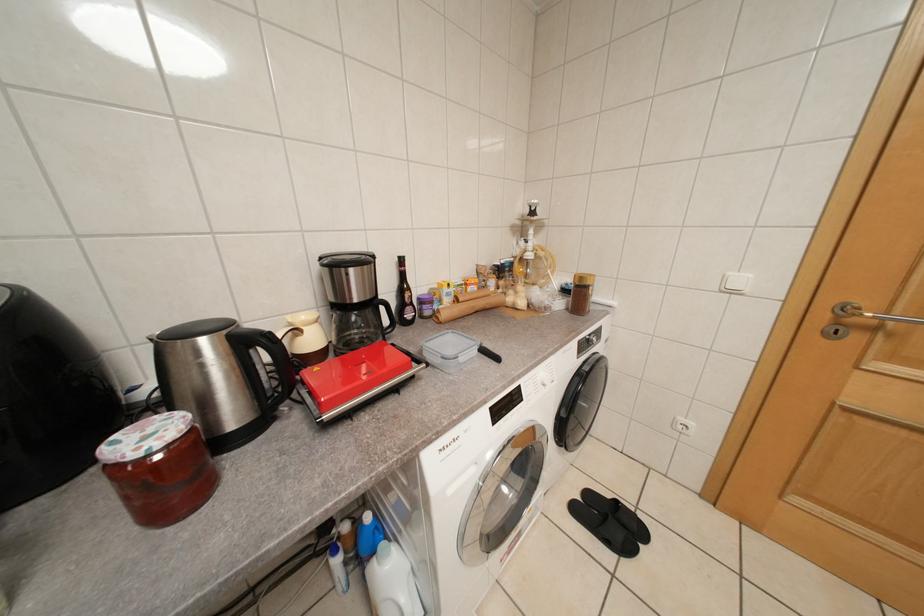
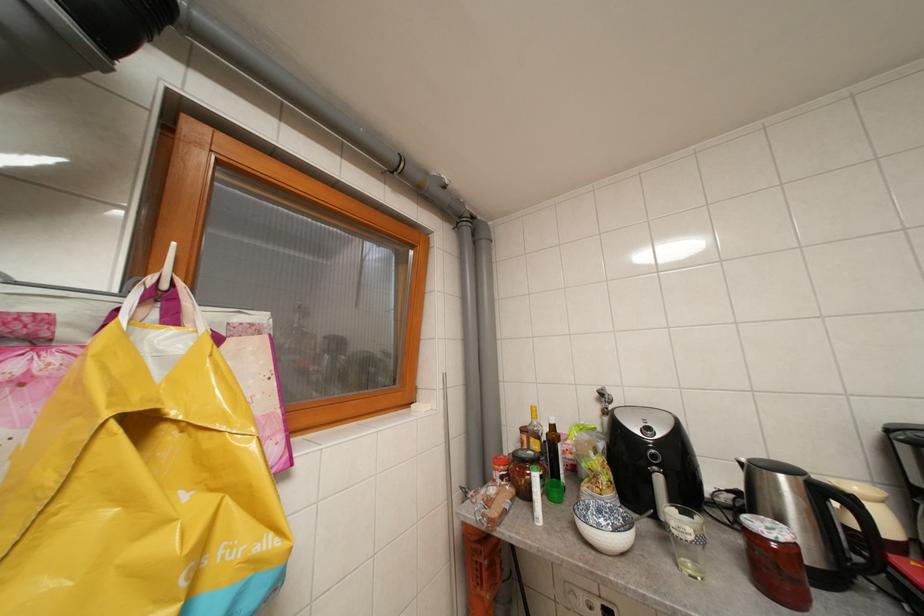
Question: How did the camera likely rotate?

Choices:
 (A) Left
 (B) Right
 (C) Up
 (D) Down

Answer: (A)